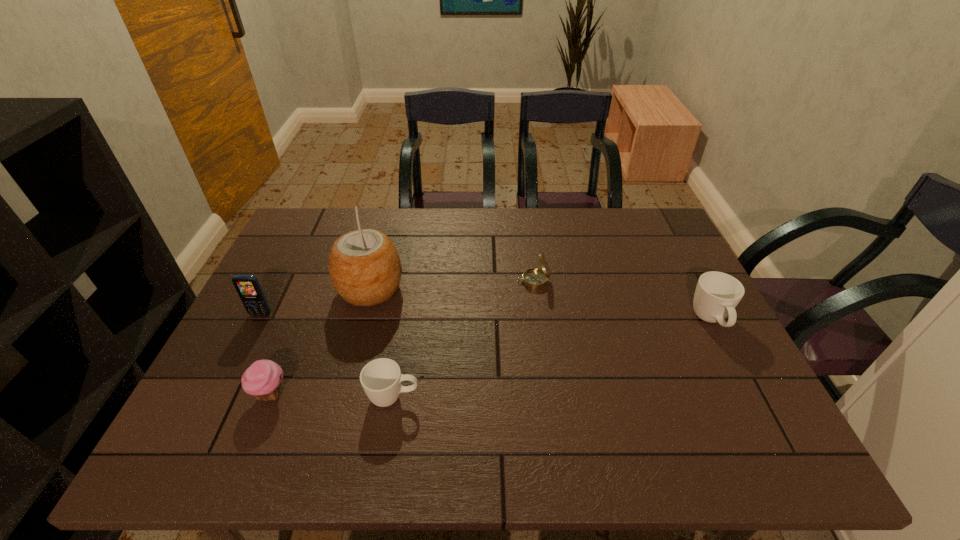
Identify the location of free space that satisfies the following two spatial constraints: 1. with the dial facing the compass; 2. on the front side of the cupcake. The height and width of the screenshot is (540, 960). [548, 394].

In order to click on free space in the image that satisfies the following two spatial constraints: 1. with the dial facing the compass; 2. on the screen of the leftmost object in this screenshot , I will do `click(538, 314)`.

This screenshot has width=960, height=540. Identify the location of vacant space that satisfies the following two spatial constraints: 1. on the screen of the cellular telephone; 2. on the right side of the cupcake. (221, 394).

You are a GUI agent. You are given a task and a screenshot of the screen. Output one action in this format:
    pyautogui.click(x=<x>, y=<y>)
    Task: Click on the free space that satisfies the following two spatial constraints: 1. with the dial facing the compass; 2. on the front side of the cupcake
    The width and height of the screenshot is (960, 540).
    Given the screenshot: What is the action you would take?
    pyautogui.click(x=548, y=394)